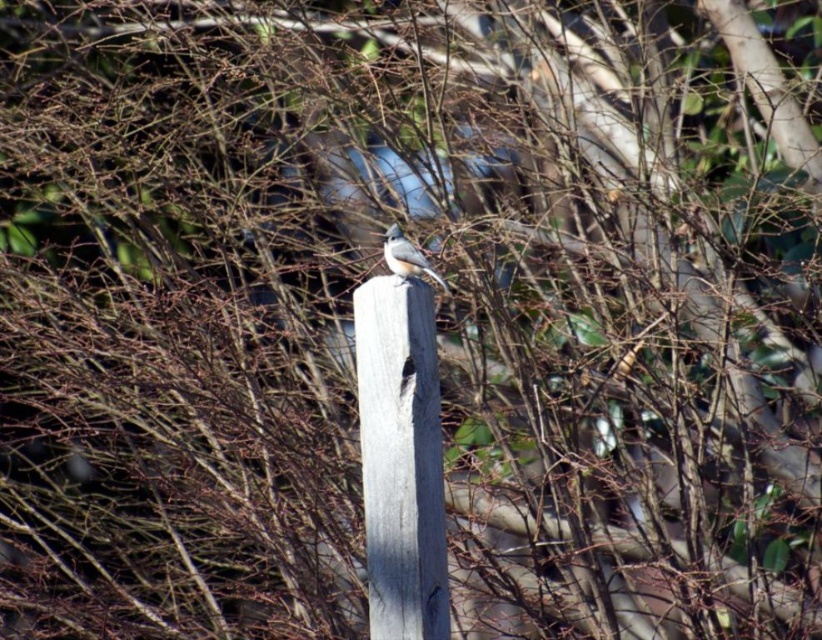
Is gray wood pole at center shorter than grayish-brown feathers at center?

In fact, gray wood pole at center may be taller than grayish-brown feathers at center.

Based on the photo, who is more forward, [435,589] or [395,273]?

Positioned in front is point [435,589].

Locate an element on the screen. The width and height of the screenshot is (822, 640). gray wood pole at center is located at coordinates (400, 460).